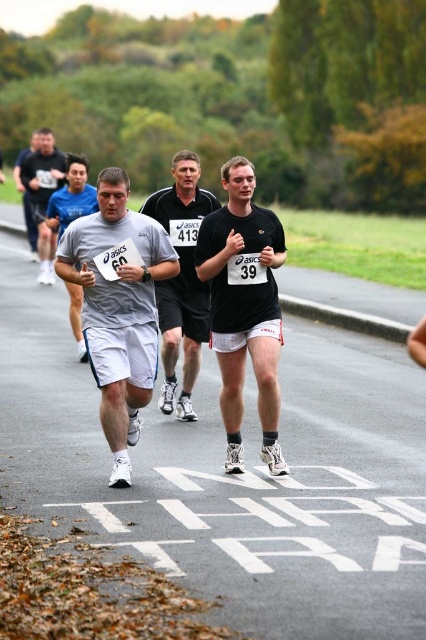
Question: Is black matte shorts at center above gray fabric shirt at center?

Choices:
 (A) yes
 (B) no

Answer: (B)

Question: Can you confirm if matte black shirt at center is positioned above gray fabric shirt at left?

Choices:
 (A) yes
 (B) no

Answer: (B)

Question: Which point appears closest to the camera in this image?

Choices:
 (A) (175, 330)
 (B) (54, 248)
 (C) (271, 317)

Answer: (C)

Question: Which object appears closest to the camera in this image?

Choices:
 (A) gray fabric shorts at left
 (B) black matte shorts at center

Answer: (A)

Question: Which point appears closest to the camera in this image?

Choices:
 (A) (37, 225)
 (B) (17, 182)
 (C) (115, 289)
 (D) (227, 348)

Answer: (C)

Question: Can you confirm if gray fabric shorts at left is positioned to the left of black matte shorts at center?

Choices:
 (A) no
 (B) yes

Answer: (B)